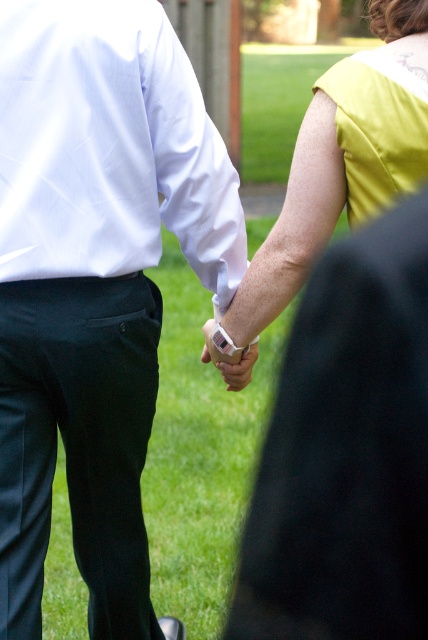
Question: In this image, where is yellow matte dress at center located relative to white matte wristband at center?

Choices:
 (A) right
 (B) left

Answer: (A)

Question: Which point is closer to the camera taking this photo?

Choices:
 (A) (211, 353)
 (B) (404, 44)
 (C) (5, 323)

Answer: (B)

Question: Is yellow matte dress at center positioned at the back of white matte wristband at center?

Choices:
 (A) yes
 (B) no

Answer: (B)

Question: Estimate the real-world distances between objects in this image. Which object is closer to the matte yellow dress at upper right?

Choices:
 (A) white matte wristband at center
 (B) yellow matte dress at center
 (C) white matte shirt at center

Answer: (B)

Question: Which point is farther from the camera taking this photo?

Choices:
 (A) click(204, 330)
 (B) click(33, 1)

Answer: (A)

Question: Where is white matte shirt at center located in relation to yellow matte dress at center in the image?

Choices:
 (A) right
 (B) left

Answer: (B)